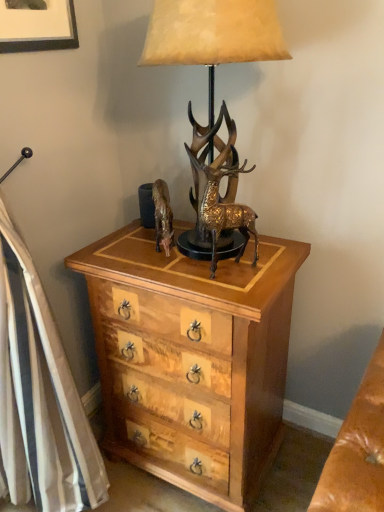
Question: Considering the positions of wooden chest of drawers at center and gold textured deer at center in the image, is wooden chest of drawers at center taller or shorter than gold textured deer at center?

Choices:
 (A) tall
 (B) short

Answer: (A)

Question: In the image, is wooden chest of drawers at center positioned in front of or behind gold textured deer at center?

Choices:
 (A) behind
 (B) front

Answer: (A)

Question: Estimate the real-world distances between objects in this image. Which object is farther from the wooden chest of drawers at center?

Choices:
 (A) metallic gold lamp at center
 (B) matte black picture frame at upper left
 (C) gold metallic horse at center
 (D) gold textured deer at center

Answer: (B)

Question: Estimate the real-world distances between objects in this image. Which object is closer to the gold metallic horse at center?

Choices:
 (A) metallic gold lamp at center
 (B) gold textured deer at center
 (C) wooden chest of drawers at center
 (D) matte black picture frame at upper left

Answer: (B)